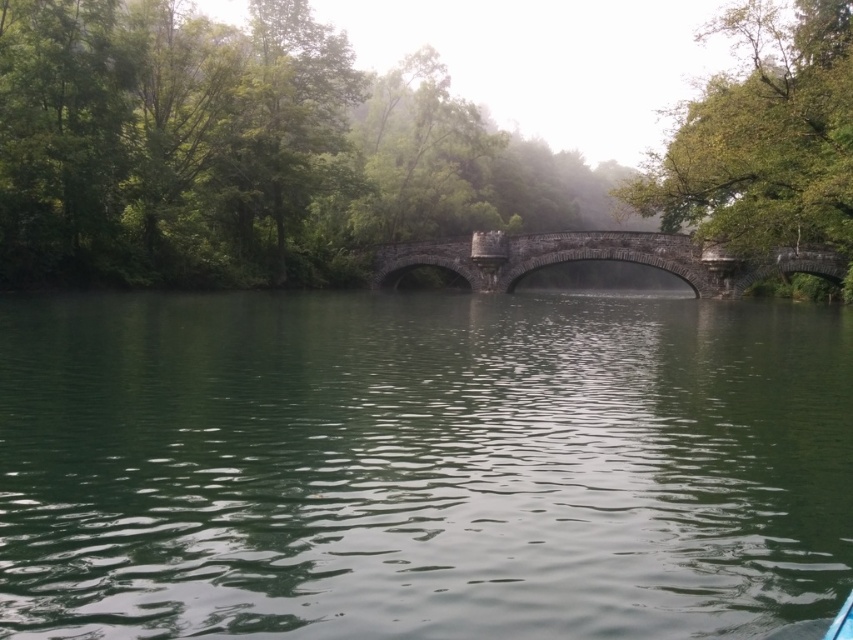
You are standing at the edge of the water and want to walk towards the dark gray stone bridge at center. However, there is a green leafy tree at center blocking your path. Can you walk around the tree to reach the bridge?

The green leafy tree at center is closer to the viewer than the dark gray stone bridge at center, so you can walk around the tree to reach the bridge since it is in front of the bridge.

You are standing at the lakeside and want to take a photo of the green leafy tree at upper right and the dark gray stone bridge at center. Which object should you focus on first to ensure both are in frame?

You should focus on the green leafy tree at upper right first because it is closer to you than the dark gray stone bridge at center, ensuring both are in frame.

You are a photographer planning to capture a wide shot of the dark gray stone bridge at center and the green leafy tree at upper right. Based on the scene, which object would appear narrower in your photo?

The green leafy tree at upper right would appear narrower in the photo since its width is less than that of the dark gray stone bridge at center.